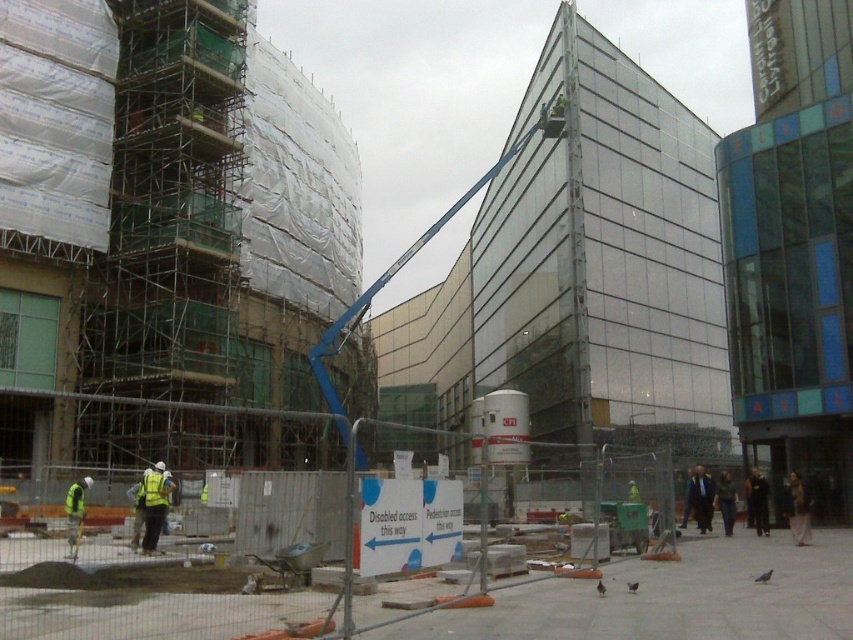
Based on the photo, you are a construction worker who just arrived at the site. You need to locate your safety gear. You see a reflective yellow vest at lower left and a yellow reflective safety vest at lower left. Which one is closer to the ground?

The reflective yellow vest at lower left is positioned under the yellow reflective safety vest at lower left, so the reflective yellow vest at lower left is closer to the ground.

You are a construction worker standing at the yellow reflective safety vest at lower left. Looking towards the silver metallic scaffolding at left, which direction should you move to reach the scaffolding?

The silver metallic scaffolding at left is to the right of your current position at the yellow reflective safety vest at lower left. To reach it, you should move to your right.